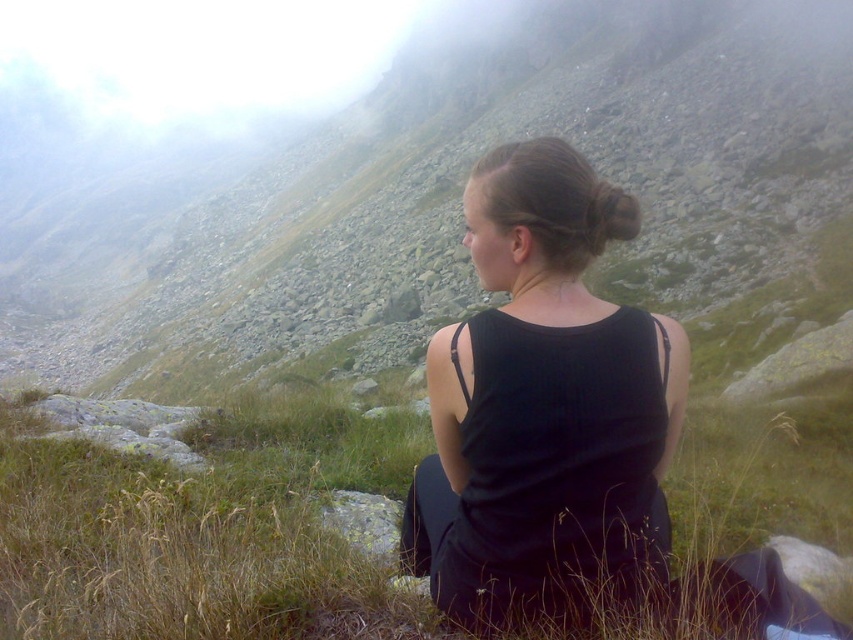
Is green grassy hillside at center thinner than black matte dress at center?

No.

What are the coordinates of `green grassy hillside at center` in the screenshot? It's located at (459, 189).

You are a GUI agent. You are given a task and a screenshot of the screen. Output one action in this format:
    pyautogui.click(x=<x>, y=<y>)
    Task: Click on the green grassy hillside at center
    
    Given the screenshot: What is the action you would take?
    pyautogui.click(x=459, y=189)

Between point (683, 209) and point (20, 460), which one is positioned behind?

The point (683, 209) is more distant.

Can you confirm if green grassy hillside at center is thinner than green grass at center?

No.

Find the location of a particular element. This screenshot has height=640, width=853. green grassy hillside at center is located at coordinates (459, 189).

Does green grass at center appear over black matte dress at center?

No.

Who is positioned more to the left, green grass at center or black matte dress at center?

green grass at center is more to the left.

Find the location of a particular element. green grass at center is located at coordinates (202, 531).